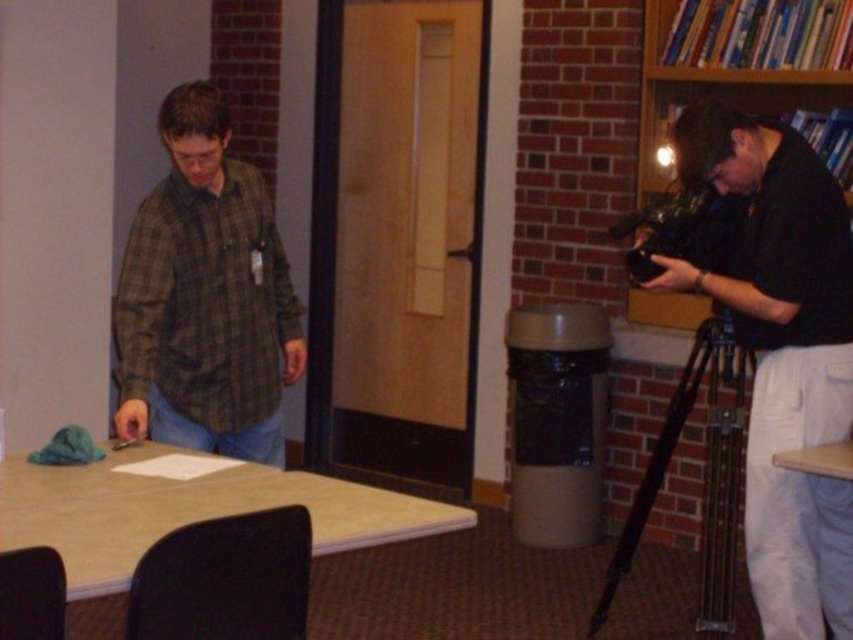
Is black plastic video camera at right thinner than wooden table at lower right?

Incorrect, black plastic video camera at right's width is not less than wooden table at lower right's.

Does black plastic video camera at right have a smaller size compared to wooden table at lower right?

Incorrect, black plastic video camera at right is not smaller in size than wooden table at lower right.

Is point (670, 221) less distant than point (850, 467)?

No, it is not.

You are a GUI agent. You are given a task and a screenshot of the screen. Output one action in this format:
    pyautogui.click(x=<x>, y=<y>)
    Task: Click on the black plastic video camera at right
    
    Given the screenshot: What is the action you would take?
    pyautogui.click(x=666, y=230)

What are the coordinates of `black metallic tripod at lower right` in the screenshot? It's located at (703, 476).

From the picture: Does black metallic tripod at lower right have a larger size compared to teal fabric at table left?

Indeed, black metallic tripod at lower right has a larger size compared to teal fabric at table left.

The width and height of the screenshot is (853, 640). I want to click on black metallic tripod at lower right, so click(x=703, y=476).

Is green plaid shirt at left above black metallic tripod at lower right?

Yes.

Is point (142, 419) positioned behind point (686, 362)?

No, (142, 419) is closer to viewer.

Locate an element on the screen. green plaid shirt at left is located at coordinates (206, 298).